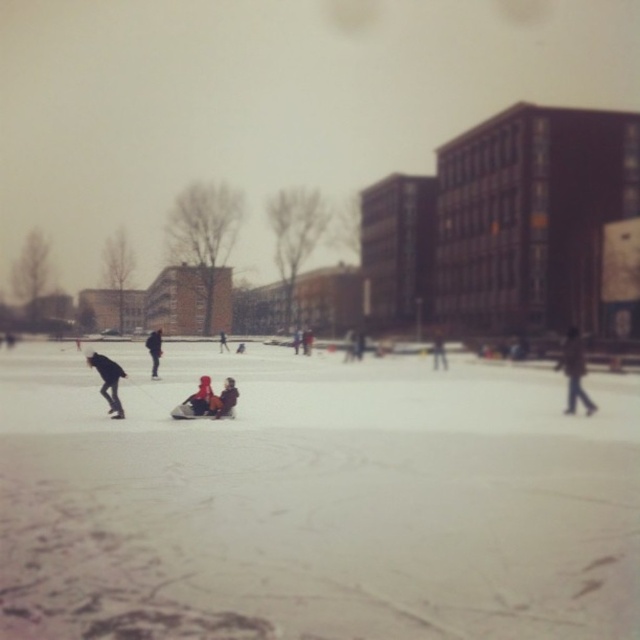
You are a photographer trying to capture a clear shot of both the dark brown leather jacket at center and the dark blue jacket at center. Since you want both subjects to appear equally prominent in the photo, which jacket should you adjust your camera focus to prioritize, and why?

The dark brown leather jacket at center is much taller than the dark blue jacket at center, so to make both appear equally prominent in the photo, you should focus more on the dark blue jacket at center since it is shorter and might need to be emphasized to balance the composition.

You are a photographer trying to capture a photo of both the dark blue jacket at left and the dark gray jacket at center. Based on their positions, which jacket should you focus on first to ensure both are in frame?

The dark blue jacket at left is to the right of the dark gray jacket at center, so you should focus on the dark gray jacket at center first to ensure both are in frame.

You are a photographer trying to capture a photo of both the dark blue jacket at left and the dark gray jacket at center in the same frame. Given that your camera has a maximum focus range of 15 meters, will both subjects be in focus?

The distance between the dark blue jacket at left and dark gray jacket at center is 15.46 meters. Since the camera can only focus up to 15 meters, the subjects are slightly beyond the focus range, so they won